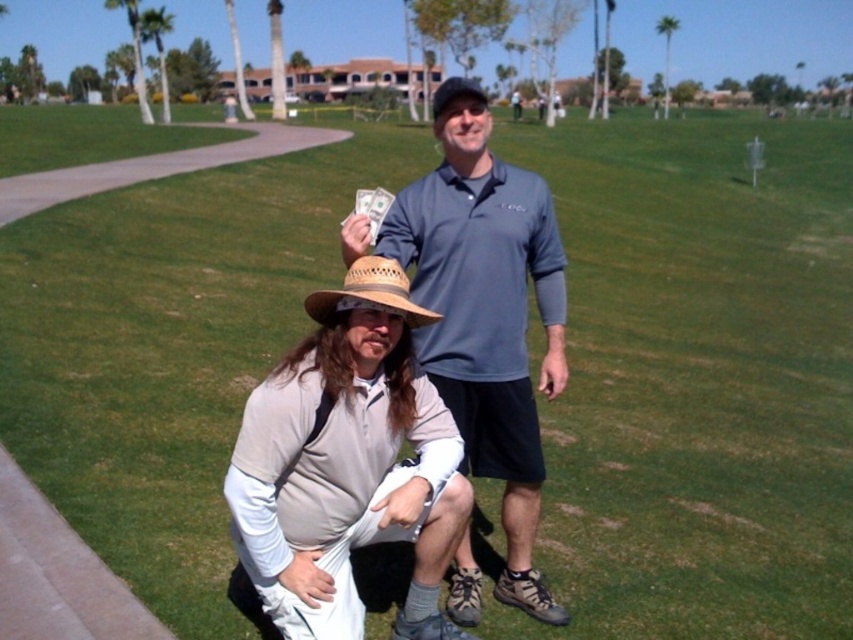
Question: Which point is closer to the camera?

Choices:
 (A) (663, 77)
 (B) (360, 298)

Answer: (B)

Question: Which object appears closest to the camera in this image?

Choices:
 (A) straw woven hat at center
 (B) beige cotton hat at lower center
 (C) matte blue shirt at center

Answer: (B)

Question: Does straw woven hat at center come in front of green leafy palm tree at upper left?

Choices:
 (A) no
 (B) yes

Answer: (B)

Question: Which of the following is the farthest from the observer?

Choices:
 (A) (x=390, y=285)
 (B) (x=432, y=97)
 (C) (x=657, y=26)

Answer: (C)

Question: Is straw woven hat at center smaller than green leafy palm tree at upper center?

Choices:
 (A) no
 (B) yes

Answer: (B)

Question: Can you confirm if beige cotton hat at lower center is positioned to the left of straw woven hat at center?

Choices:
 (A) no
 (B) yes

Answer: (B)